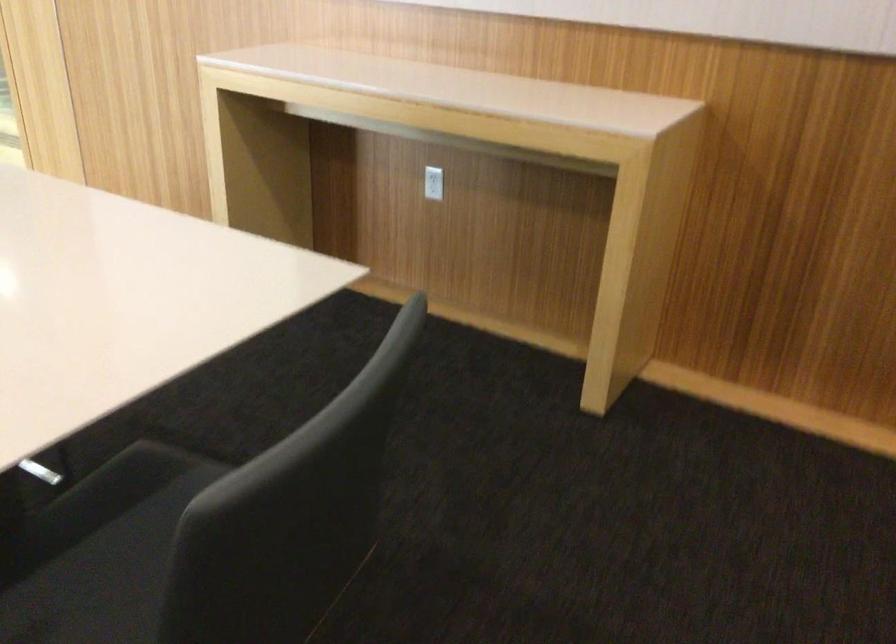
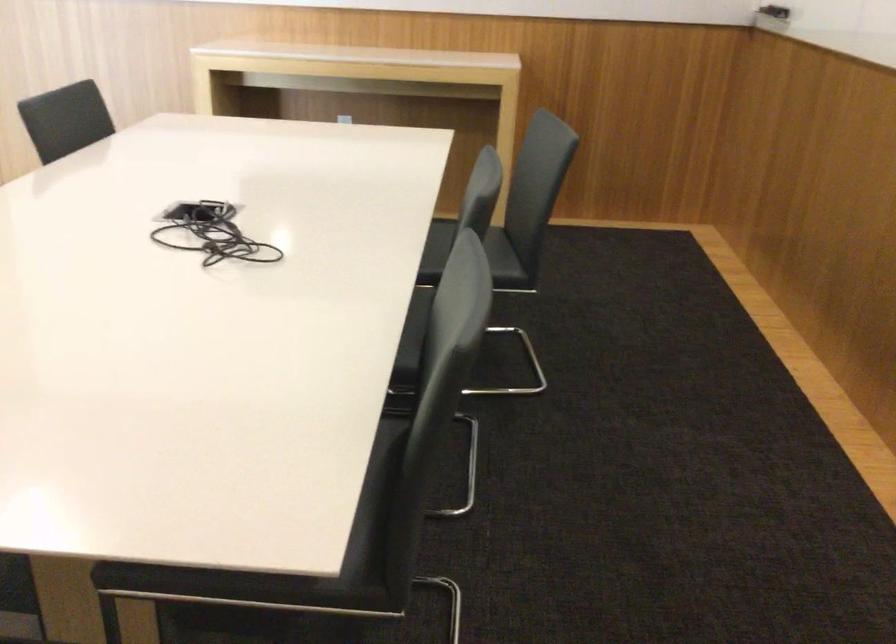
What movement of the cameraman would produce the second image?

The cameraman moved toward left, backward.